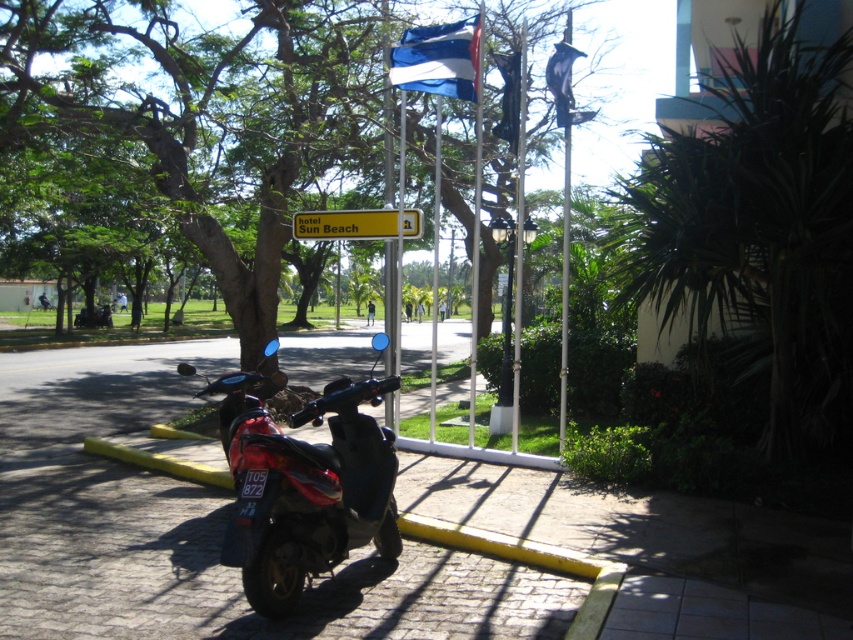
Which of these two, green leafy tree at upper right or yellow plastic sign at center, stands taller?

green leafy tree at upper right

Which is behind, point (781, 380) or point (357, 224)?

The point (357, 224) is more distant.

Image resolution: width=853 pixels, height=640 pixels. I want to click on green leafy tree at upper right, so click(759, 227).

Between green leafy tree at upper right and blue fabric flag at upper center, which one has more height?

green leafy tree at upper right

Does green leafy tree at upper right have a greater width compared to blue fabric flag at upper center?

Yes.

Who is more forward, (807, 179) or (503, 56)?

Positioned in front is point (807, 179).

This screenshot has width=853, height=640. In order to click on green leafy tree at upper right in this screenshot , I will do `click(759, 227)`.

Who is taller, green leafy tree at center or metallic flagpole at center?

With more height is green leafy tree at center.

Is point (316, 120) in front of point (430, 388)?

Yes, point (316, 120) is closer to viewer.

What are the coordinates of `green leafy tree at center` in the screenshot? It's located at (189, 122).